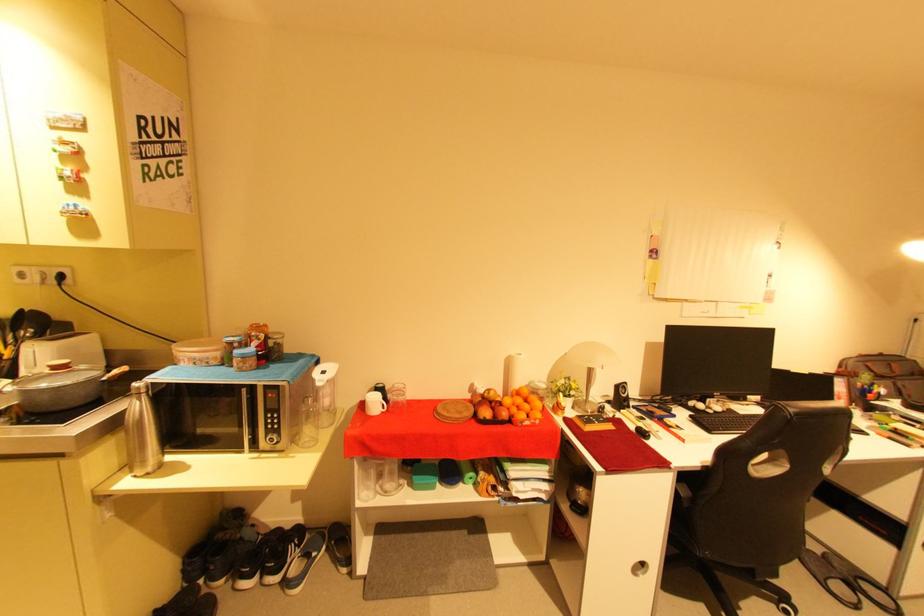
The image size is (924, 616). In order to click on bag handle in this screenshot , I will do `click(885, 365)`.